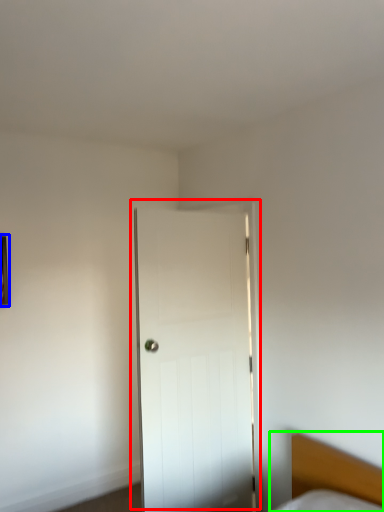
Question: Which object is positioned farthest from door (highlighted by a red box)? Select from picture frame (highlighted by a blue box) and bed (highlighted by a green box).

Choices:
 (A) picture frame
 (B) bed

Answer: (A)